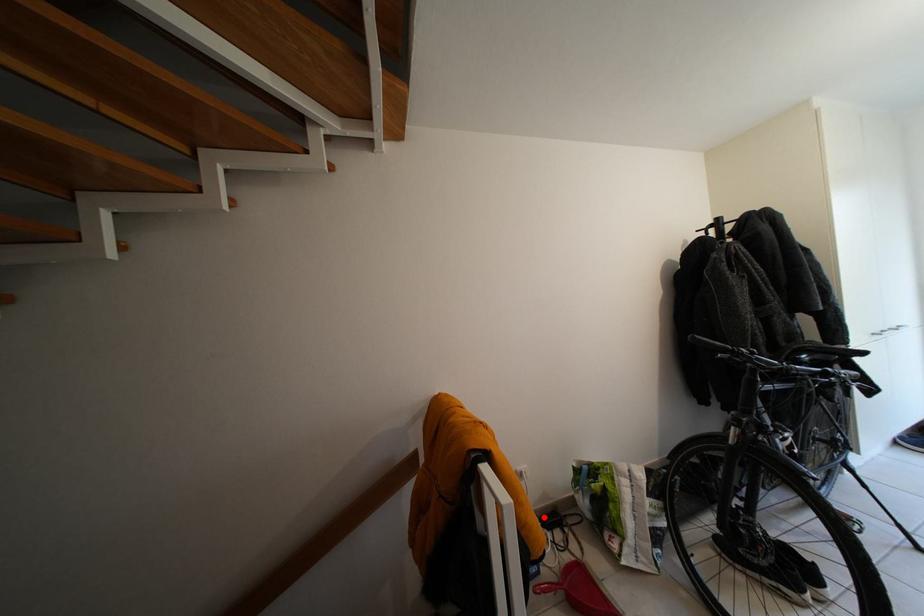
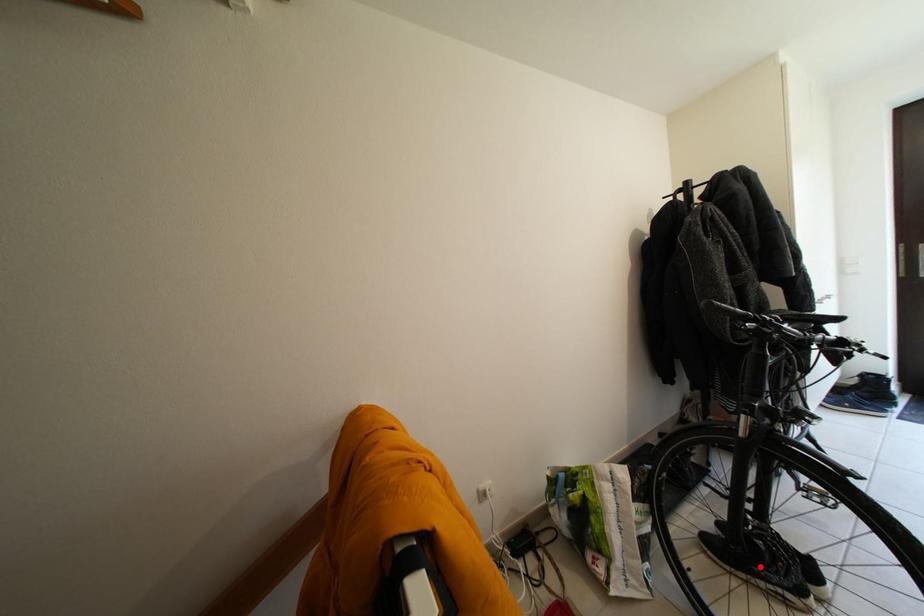
I am providing you with two images of the same scene from different viewpoints. A red point is marked on the first image and another point is marked on the second image. Does the point marked in image1 correspond to the same location as the one in image2?

No